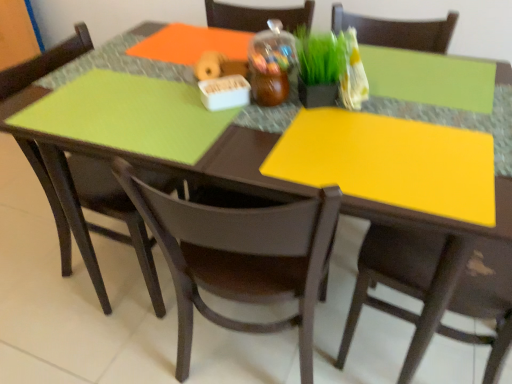
Find the location of a particular element. The width and height of the screenshot is (512, 384). vacant position to the left of matte black chair at lower left, which is counted as the 3th chair, starting from the right is located at coordinates (29, 270).